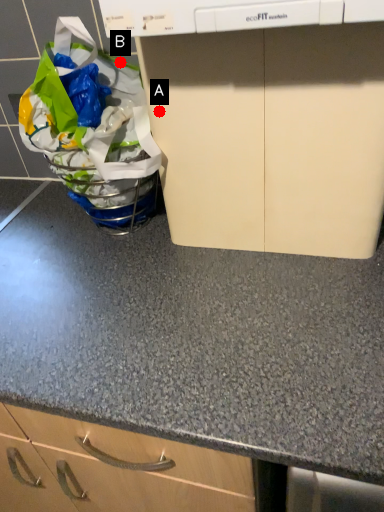
Question: Two points are circled on the image, labeled by A and B beside each circle. Which point is closer to the camera taking this photo?

Choices:
 (A) A is closer
 (B) B is closer

Answer: (A)